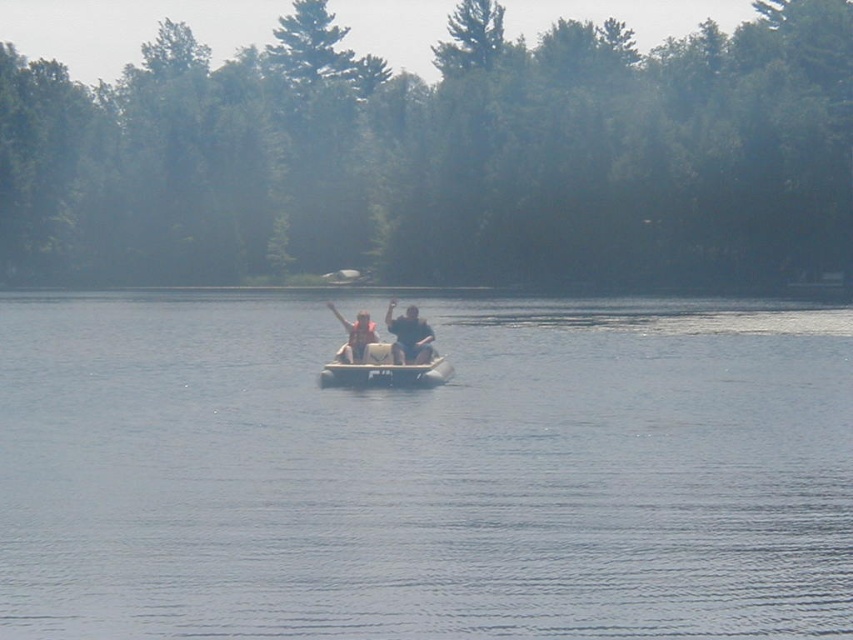
Which of these two, beige rubber boat at center or light brown wooden paddle boat at center, stands shorter?

With less height is beige rubber boat at center.

Does point (346, 365) come in front of point (367, 337)?

Yes, it is in front of point (367, 337).

This screenshot has height=640, width=853. Find the location of `beige rubber boat at center`. beige rubber boat at center is located at coordinates (383, 371).

Between point (421, 342) and point (358, 316), which one is positioned behind?

Positioned behind is point (358, 316).

Locate an element on the screen. Image resolution: width=853 pixels, height=640 pixels. dark blue fabric life vest at center is located at coordinates (409, 337).

The image size is (853, 640). Find the location of `dark blue fabric life vest at center`. dark blue fabric life vest at center is located at coordinates (409, 337).

At what (x,y) coordinates should I click in order to perform the action: click on dark blue fabric life vest at center. Please return your answer as a coordinate pair (x, y). This screenshot has height=640, width=853. Looking at the image, I should click on (409, 337).

Who is more forward, (795, 321) or (409, 372)?

Point (409, 372) is in front.

Can you confirm if clear blue water at center is wider than beige rubber boat at center?

Yes, clear blue water at center is wider than beige rubber boat at center.

Find the location of a particular element. clear blue water at center is located at coordinates (424, 472).